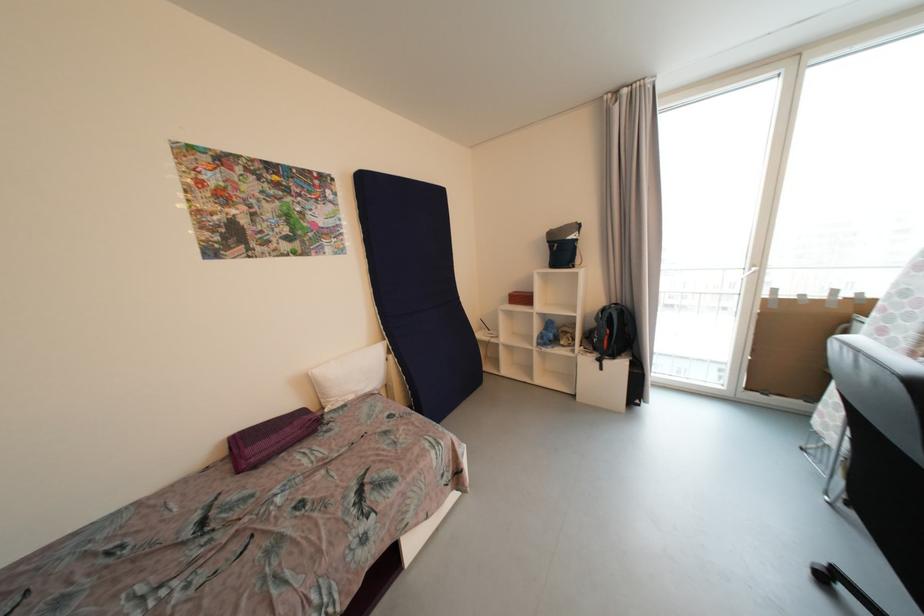
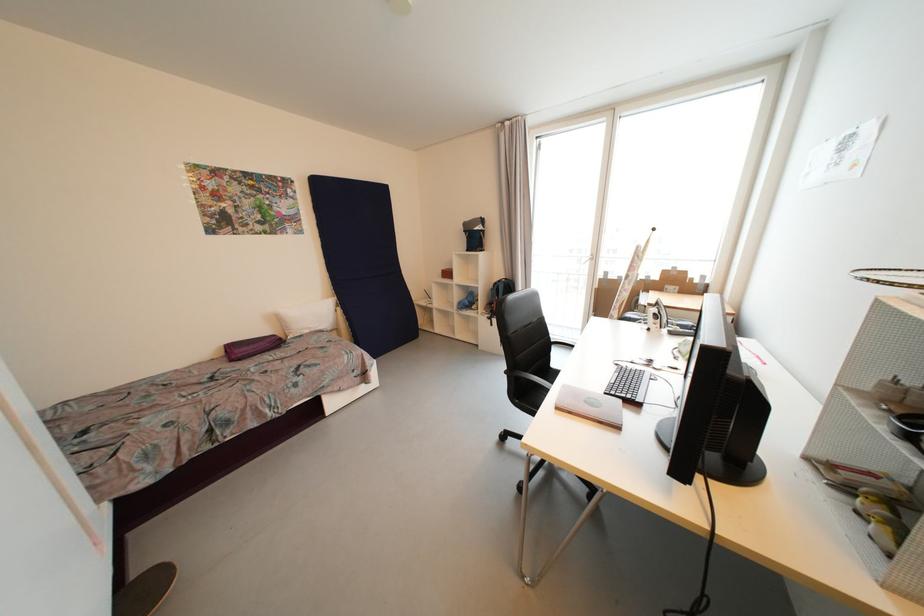
Find the pixel in the second image that matches point 396,359 in the first image.

(344, 310)